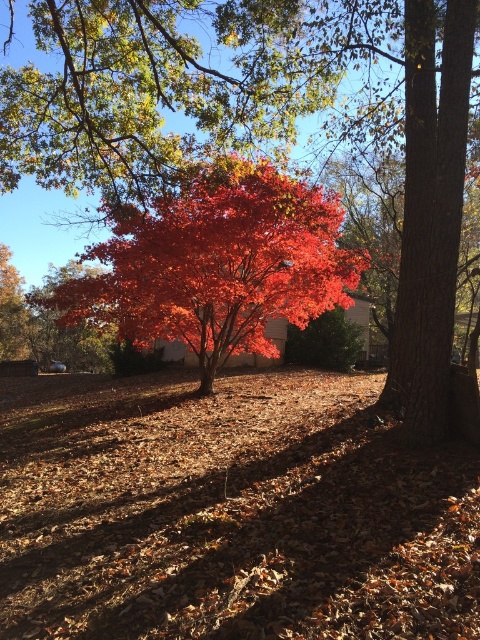
Does point (460, 26) lie in front of point (168, 339)?

Yes, it is in front of point (168, 339).

Can you confirm if shiny red maple tree at center is thinner than glossy red maple at center?

No, shiny red maple tree at center is not thinner than glossy red maple at center.

Who is more distant from viewer, (149, 70) or (165, 209)?

Point (149, 70)

This screenshot has height=640, width=480. In order to click on shiny red maple tree at center in this screenshot , I will do `click(253, 124)`.